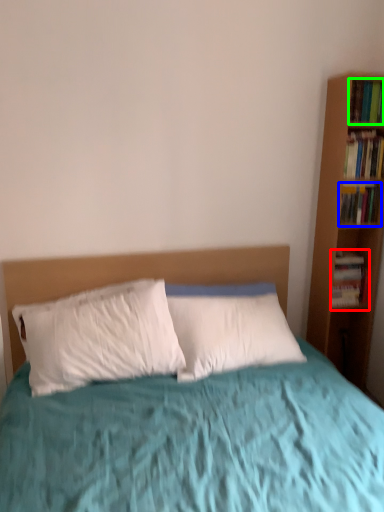
Question: Which object is the closest to the book (highlighted by a red box)? Choose among these: book (highlighted by a blue box) or book (highlighted by a green box).

Choices:
 (A) book
 (B) book

Answer: (A)